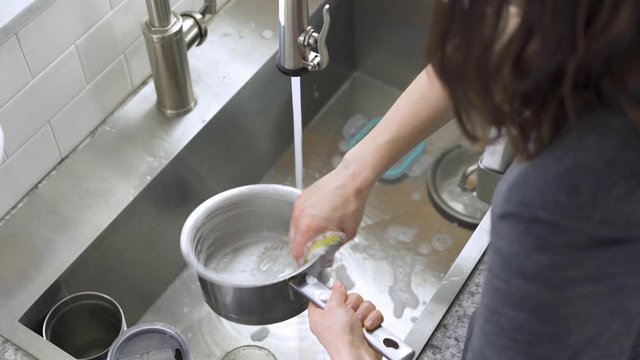
This screenshot has width=640, height=360. Identify the location of sponge in the hand of the girl. (328, 234).